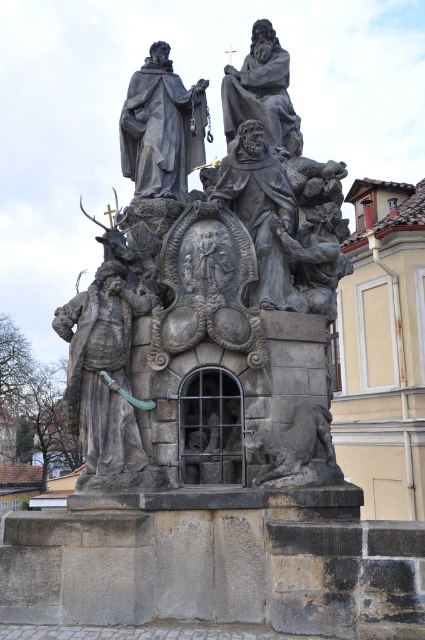
Does polished stone statue at center lie behind gray stone lion at lower center?

Yes.

Based on the photo, between polished stone statue at center and gray stone lion at lower center, which one appears on the right side from the viewer's perspective?

Positioned to the right is gray stone lion at lower center.

Describe the element at coordinates (209, 296) in the screenshot. I see `polished stone statue at center` at that location.

Find the location of a particular element. The width and height of the screenshot is (425, 640). polished stone statue at center is located at coordinates (209, 296).

Is polished bronze figure at lower left wider than polished stone figure at center?

Indeed, polished bronze figure at lower left has a greater width compared to polished stone figure at center.

In order to click on polished bronze figure at lower left in this screenshot , I will do `click(102, 371)`.

The height and width of the screenshot is (640, 425). In order to click on polished bronze figure at lower left in this screenshot , I will do `click(102, 371)`.

Is matte gray statue at upper center below polished bronze statue at upper center?

Actually, matte gray statue at upper center is above polished bronze statue at upper center.

Can you confirm if matte gray statue at upper center is bigger than polished bronze statue at upper center?

Yes.

Where is `matte gray statue at upper center`? The height and width of the screenshot is (640, 425). matte gray statue at upper center is located at coordinates (161, 128).